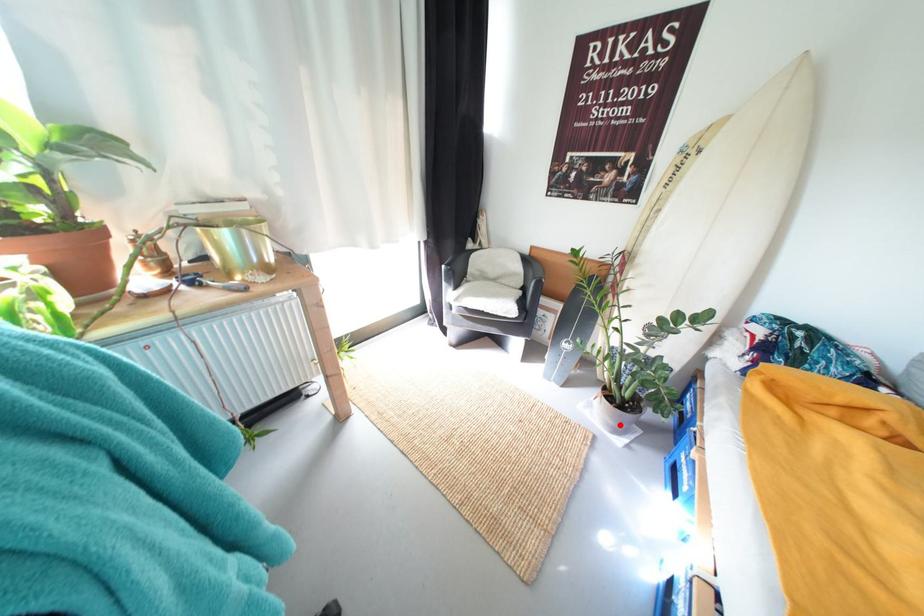
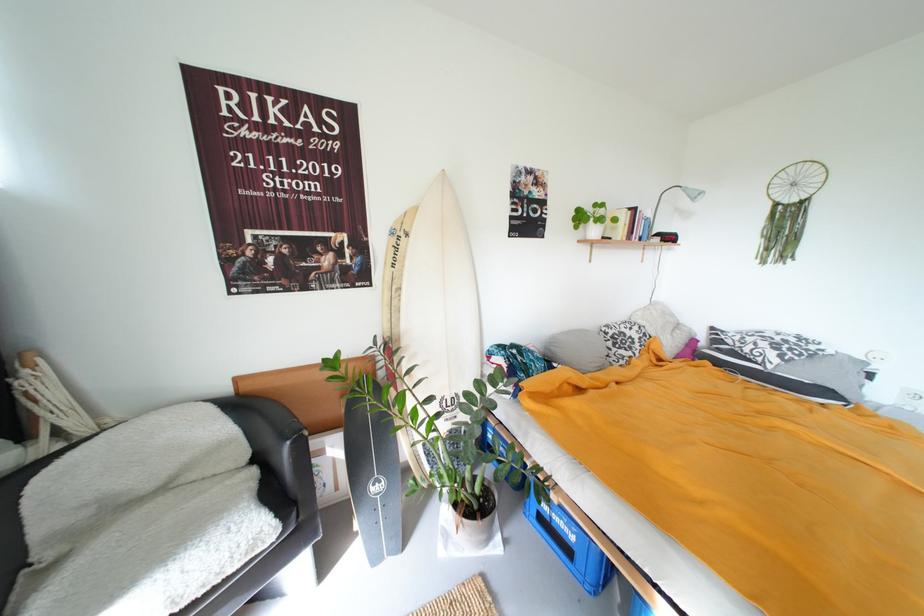
Question: I am providing you with two images of the same scene from different viewpoints. A red point is shown in image1. For the corresponding object point in image2, is it positioned nearer or farther from the camera?

Choices:
 (A) Nearer
 (B) Farther

Answer: (B)